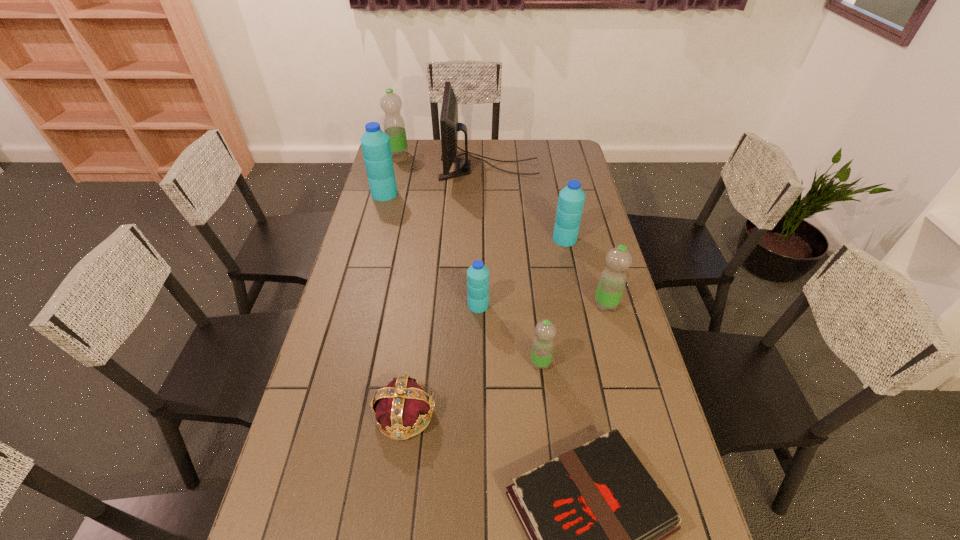
Locate an element on the screen. the second green water bottle from right to left is located at coordinates (543, 344).

I want to click on the nearest blue water bottle, so click(478, 274).

Locate an element on the screen. The image size is (960, 540). the second blue water bottle from right to left is located at coordinates [x=478, y=274].

Locate an element on the screen. This screenshot has height=540, width=960. purple crown is located at coordinates (403, 404).

Locate an element on the screen. This screenshot has width=960, height=540. crown is located at coordinates (403, 404).

Find the location of `vacant space located on the screen side of the computer monitor`. vacant space located on the screen side of the computer monitor is located at coordinates (386, 168).

Image resolution: width=960 pixels, height=540 pixels. Identify the location of free space located on the screen side of the computer monitor. (377, 168).

Where is `vacant space situated 0.170m on the screen side of the computer monitor`? vacant space situated 0.170m on the screen side of the computer monitor is located at coordinates (402, 168).

Where is `free space located on the front of the biggest green water bottle`? The height and width of the screenshot is (540, 960). free space located on the front of the biggest green water bottle is located at coordinates pyautogui.click(x=393, y=177).

The height and width of the screenshot is (540, 960). I want to click on free space located on the front of the biggest blue water bottle, so click(372, 241).